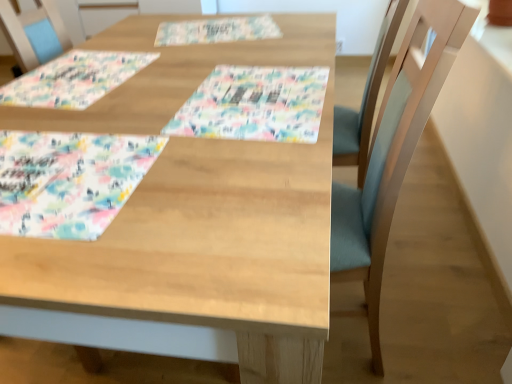
You are a GUI agent. You are given a task and a screenshot of the screen. Output one action in this format:
    pyautogui.click(x=<x>, y=<y>)
    Task: Click on the vacant space in front of floral paper placemat at upper center, which is the first place mat from top to bottom
    The image size is (512, 384).
    Given the screenshot: What is the action you would take?
    pyautogui.click(x=214, y=61)